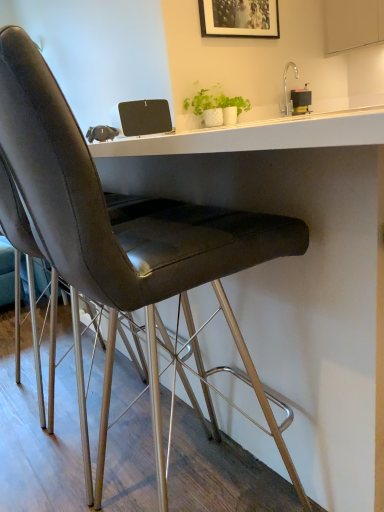
Question: Is wooden picture frame at upper center situated inside white matte cabinet at upper right or outside?

Choices:
 (A) outside
 (B) inside

Answer: (A)

Question: Would you say wooden picture frame at upper center is to the left or to the right of white matte cabinet at upper right in the picture?

Choices:
 (A) right
 (B) left

Answer: (B)

Question: In terms of width, does wooden picture frame at upper center look wider or thinner when compared to white matte cabinet at upper right?

Choices:
 (A) wide
 (B) thin

Answer: (B)

Question: Choose the correct answer: Is white matte cabinet at upper right inside wooden picture frame at upper center or outside it?

Choices:
 (A) inside
 (B) outside

Answer: (B)

Question: Considering the relative positions of white matte cabinet at upper right and wooden picture frame at upper center in the image provided, is white matte cabinet at upper right to the left or to the right of wooden picture frame at upper center?

Choices:
 (A) right
 (B) left

Answer: (A)

Question: Relative to wooden picture frame at upper center, is white matte cabinet at upper right in front or behind?

Choices:
 (A) front
 (B) behind

Answer: (B)

Question: From the image's perspective, is white matte cabinet at upper right above or below wooden picture frame at upper center?

Choices:
 (A) below
 (B) above

Answer: (B)